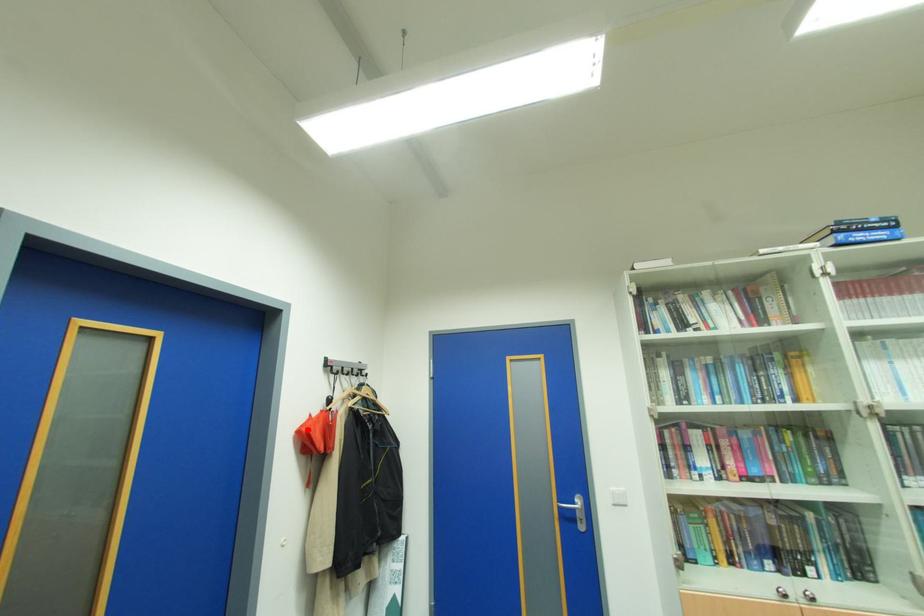
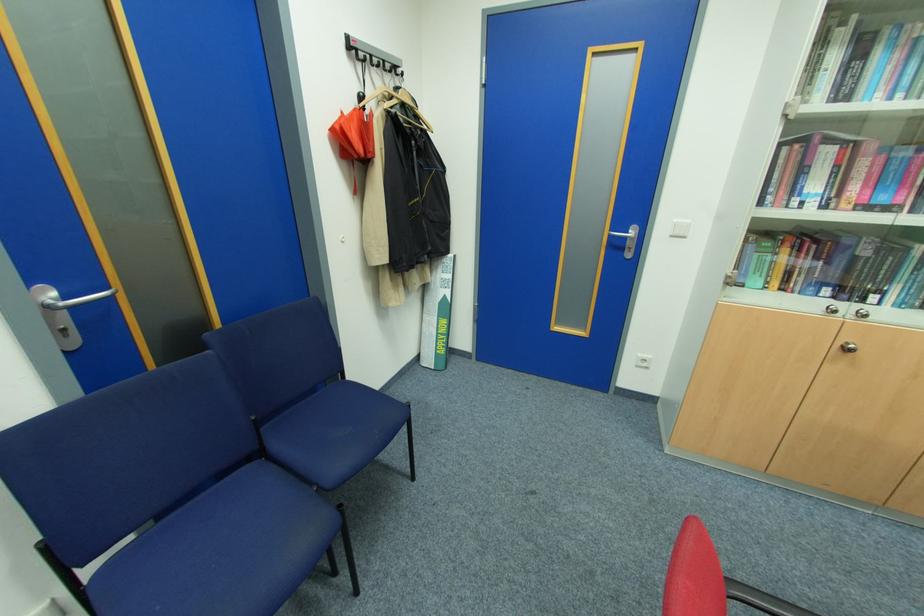
Locate, in the second image, the point that corresponds to the highlighted location in the first image.

(341, 127)